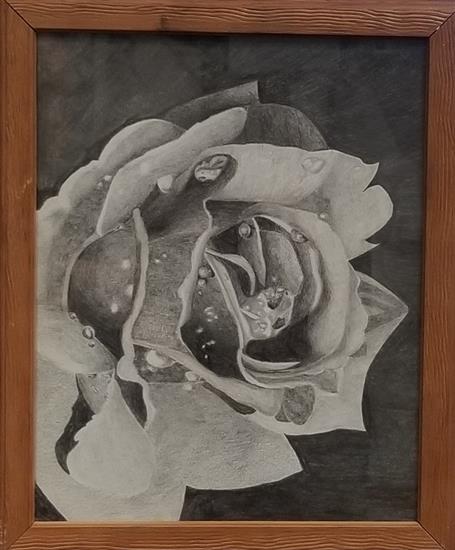
Locate an element on the screen. The width and height of the screenshot is (455, 550). left side of picture frame is located at coordinates (10, 298).